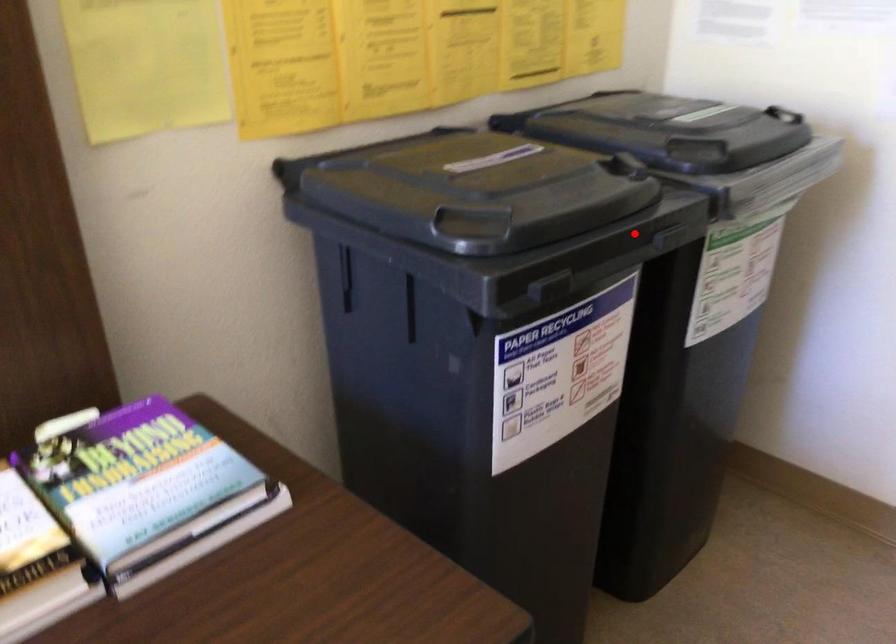
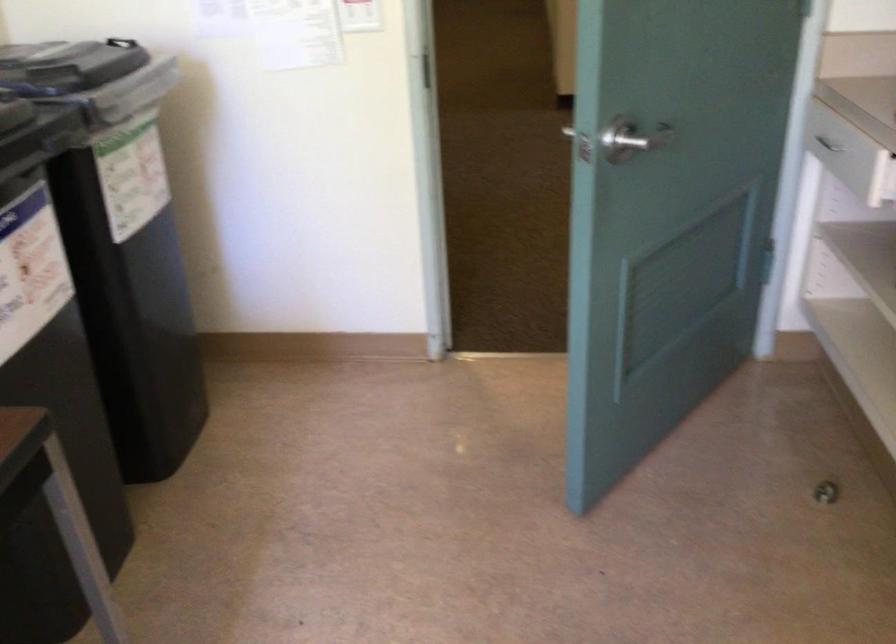
Locate, in the second image, the point that corresponds to the highlighted location in the first image.

(39, 135)